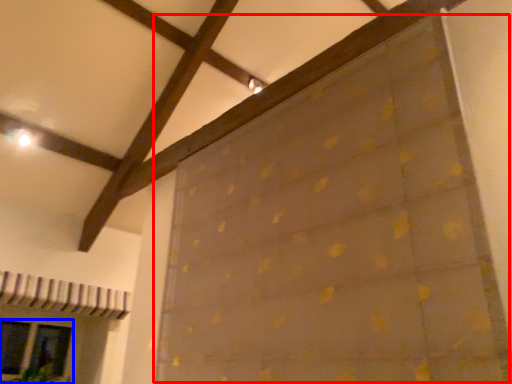
Question: Which object appears closest to the camera in this image, curtain (highlighted by a red box) or glass door (highlighted by a blue box)?

Choices:
 (A) curtain
 (B) glass door

Answer: (A)